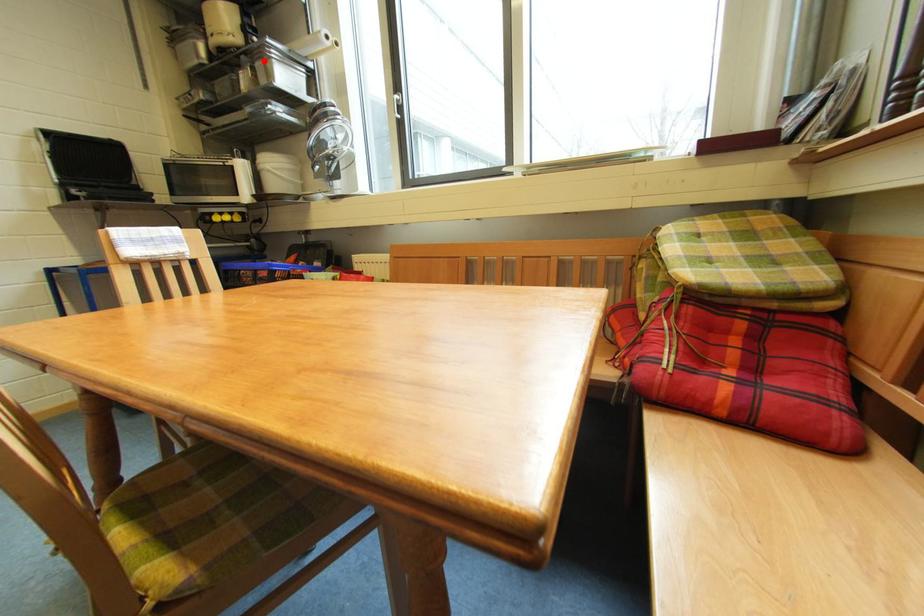
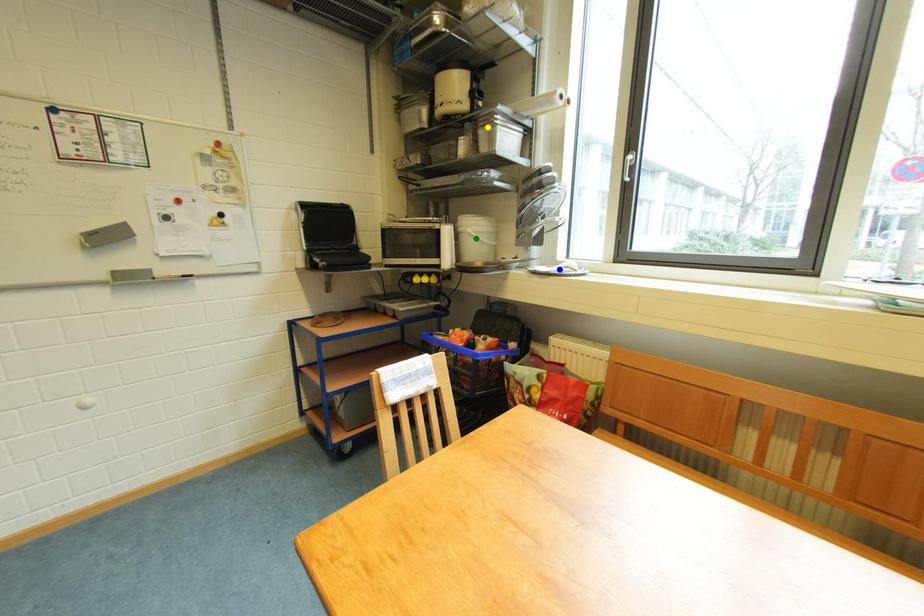
Question: I am providing you with two images of the same scene from different viewpoints. A red point is marked on the first image. You are given multiple points on the second image. In image 2, which mark is for the same physical point as the one in image 1?

Choices:
 (A) yellow point
 (B) green point
 (C) blue point

Answer: (A)